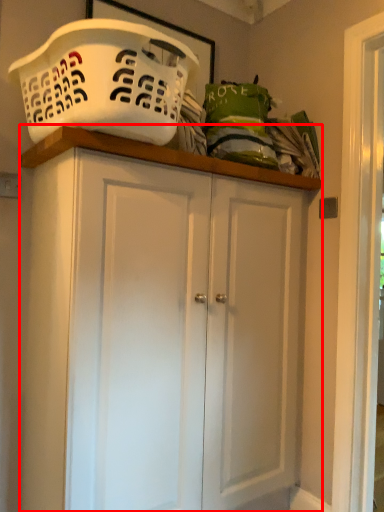
Question: From the image's perspective, where is cupboard (annotated by the red box) located relative to basket container?

Choices:
 (A) above
 (B) below

Answer: (B)